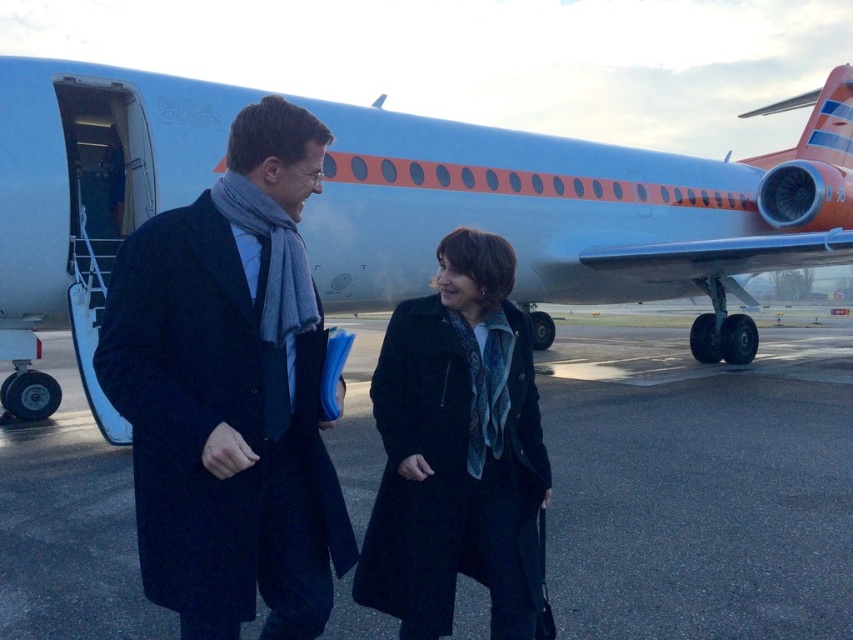
Who is higher up, black asphalt at center or black wool coat at center?

black wool coat at center is higher up.

Does point (640, 547) come farther from viewer compared to point (537, 566)?

Yes, it is behind point (537, 566).

You are a GUI agent. You are given a task and a screenshot of the screen. Output one action in this format:
    pyautogui.click(x=<x>, y=<y>)
    Task: Click on the black asphalt at center
    The width and height of the screenshot is (853, 640).
    Given the screenshot: What is the action you would take?
    pyautogui.click(x=699, y=484)

Is point (695, 244) farther from viewer compared to point (685, 410)?

Yes, it is behind point (685, 410).

Can you confirm if blue matte airplane at center is thinner than black asphalt at center?

Yes.

Is point (323, 179) positioned after point (20, 545)?

That is True.

You are a GUI agent. You are given a task and a screenshot of the screen. Output one action in this format:
    pyautogui.click(x=<x>, y=<y>)
    Task: Click on the blue matte airplane at center
    This screenshot has width=853, height=640.
    Given the screenshot: What is the action you would take?
    pyautogui.click(x=579, y=212)

Can you confirm if blue matte airplane at center is wider than black wool coat at center?

Yes, blue matte airplane at center is wider than black wool coat at center.

What do you see at coordinates (579, 212) in the screenshot? Image resolution: width=853 pixels, height=640 pixels. I see `blue matte airplane at center` at bounding box center [579, 212].

Where is `blue matte airplane at center`? blue matte airplane at center is located at coordinates (579, 212).